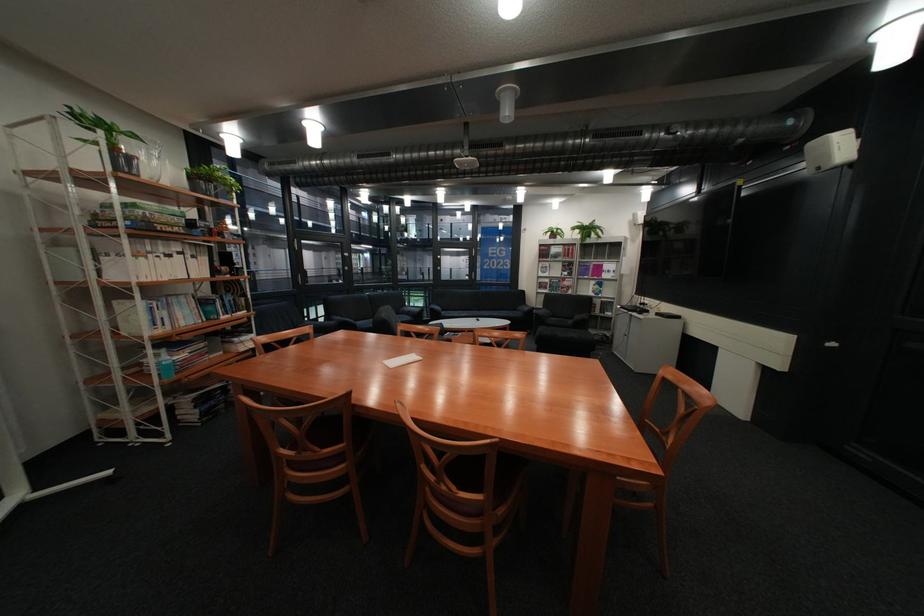
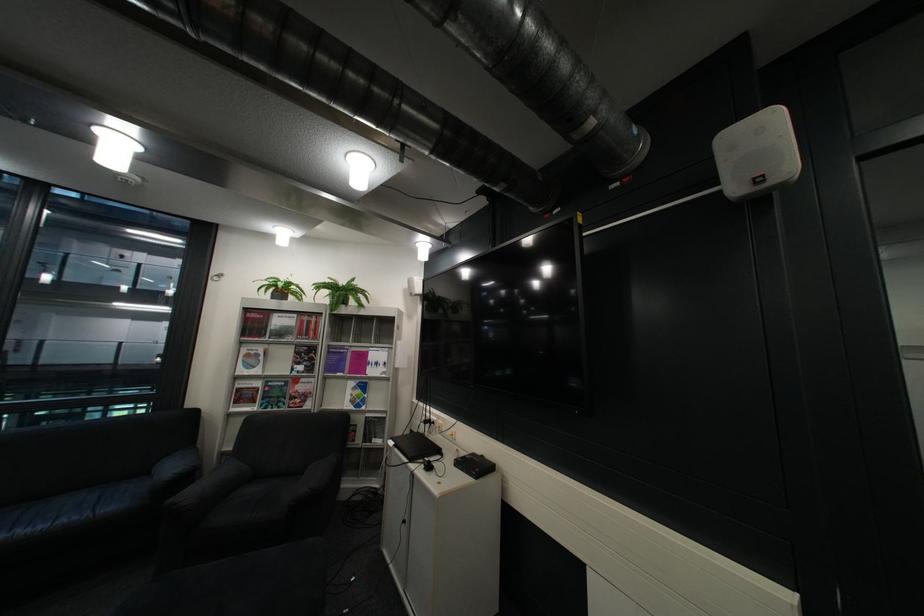
Where in the second image is the point corresponding to [555,283] from the first image?

(254, 390)